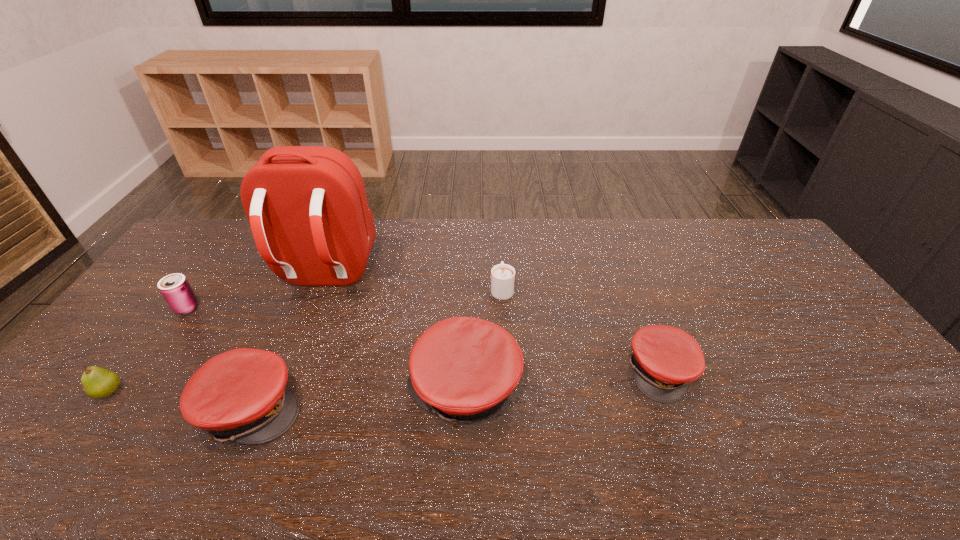
Image resolution: width=960 pixels, height=540 pixels. I want to click on vacant space that satisfies the following two spatial constraints: 1. on the strap side of the tallest object; 2. on the front of the leftmost cap with an emblem, so click(x=271, y=408).